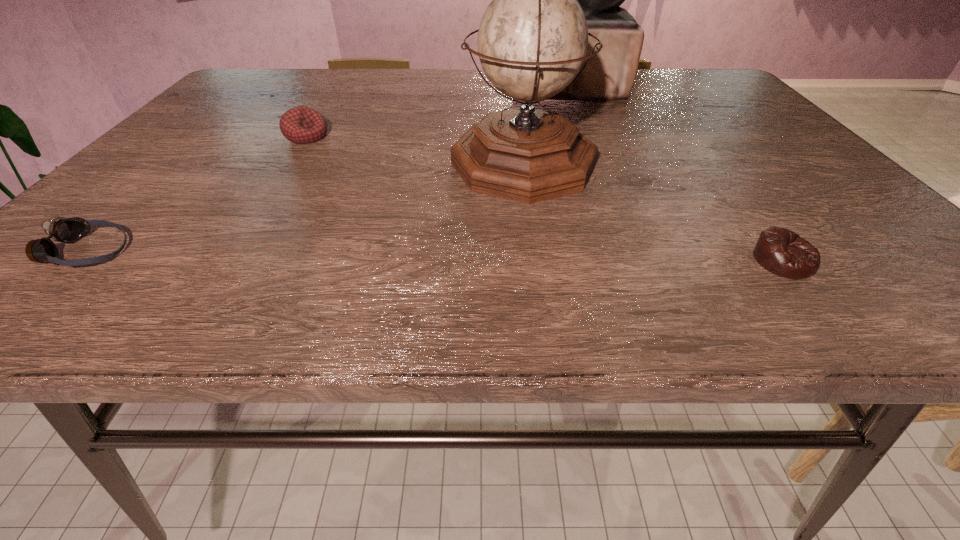
Locate an element on the screen. The width and height of the screenshot is (960, 540). vacant space located 0.250m in a relaxed pose on the farthest object is located at coordinates (433, 87).

Image resolution: width=960 pixels, height=540 pixels. What are the coordinates of `free location located 0.200m on the surface of the second tallest object` in the screenshot? It's located at tap(359, 164).

Find the location of a particular element. The width and height of the screenshot is (960, 540). vacant space situated on the surface of the second tallest object is located at coordinates (308, 164).

What are the coordinates of `free space located on the surface of the second tallest object` in the screenshot? It's located at (354, 164).

Image resolution: width=960 pixels, height=540 pixels. I want to click on vacant area situated 0.110m on the front of the left beanbag, so click(x=284, y=171).

This screenshot has width=960, height=540. Find the location of `vacant point located through the lenses of the leftmost object`. vacant point located through the lenses of the leftmost object is located at coordinates (168, 252).

What are the coordinates of `free space located on the right of the nearer beanbag` in the screenshot? It's located at (879, 261).

At what (x,y) coordinates should I click in order to perform the action: click on object that is at the far edge. Please return your answer as a coordinate pair (x, y). Looking at the image, I should click on (609, 75).

Locate an element on the screen. goggles present at the near edge is located at coordinates (60, 229).

Find the location of a particular element. beanbag located at the near edge is located at coordinates (780, 251).